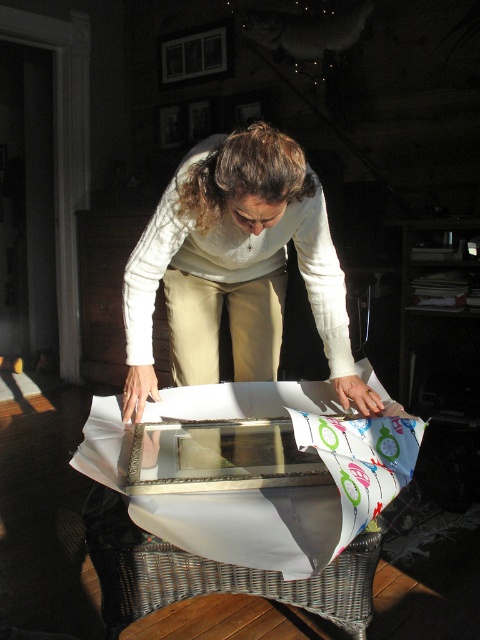
Question: Is white sweater at center below white wicker table at center?

Choices:
 (A) yes
 (B) no

Answer: (B)

Question: Is white sweater at center wider than white wicker table at center?

Choices:
 (A) yes
 (B) no

Answer: (B)

Question: Is white sweater at center wider than white wicker table at center?

Choices:
 (A) yes
 (B) no

Answer: (B)

Question: Which object is closer to the camera taking this photo?

Choices:
 (A) white sweater at center
 (B) white wicker table at center

Answer: (B)

Question: Among these objects, which one is farthest from the camera?

Choices:
 (A) white sweater at center
 (B) white wicker table at center

Answer: (A)